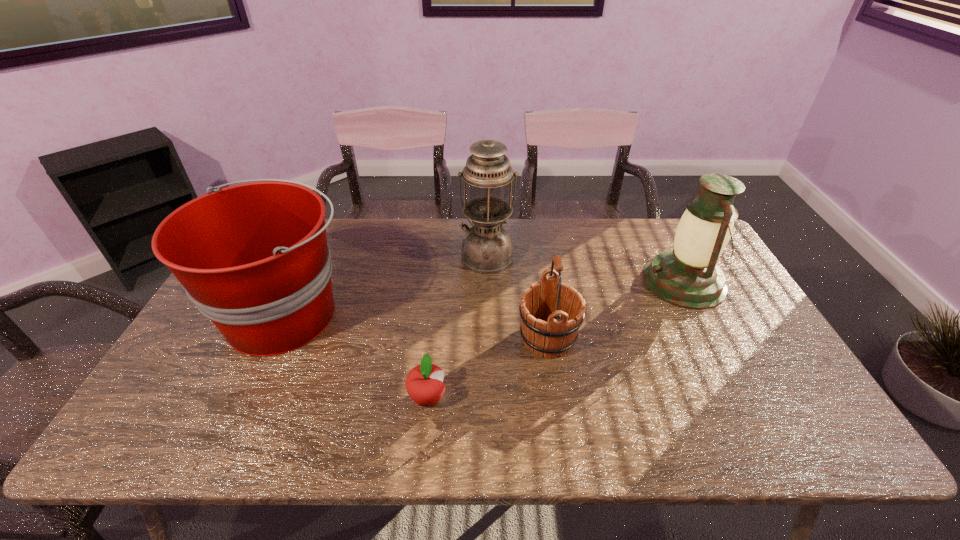
At what (x,y) coordinates should I click in order to perform the action: click on oil lamp. Please return your answer as a coordinate pair (x, y). Looking at the image, I should click on (487, 248).

This screenshot has width=960, height=540. In order to click on the rightmost object in this screenshot , I will do `click(687, 276)`.

Identify the location of bucket. The width and height of the screenshot is (960, 540). (254, 258).

At what (x,y) coordinates should I click in order to perform the action: click on wine bucket. Please return your answer as a coordinate pair (x, y). Looking at the image, I should click on (551, 312).

You are a GUI agent. You are given a task and a screenshot of the screen. Output one action in this format:
    pyautogui.click(x=<x>, y=<y>)
    Task: Click on the shortest object
    The image size is (960, 540).
    Given the screenshot: What is the action you would take?
    pyautogui.click(x=424, y=383)

Where is `the nearest object`? the nearest object is located at coordinates (424, 383).

Identify the location of vacant area situated on the back of the oil lamp. This screenshot has height=540, width=960. (487, 228).

Locate an element on the screen. vacant space located with the light compartment facing forward on the rightmost object is located at coordinates (572, 281).

You are a GUI agent. You are given a task and a screenshot of the screen. Output one action in this format:
    pyautogui.click(x=<x>, y=<y>)
    Task: Click on the free region located 0.120m with the light compartment facing forward on the rightmost object
    The image size is (960, 540).
    Given the screenshot: What is the action you would take?
    pyautogui.click(x=605, y=281)

Image resolution: width=960 pixels, height=540 pixels. I want to click on vacant space situated with the light compartment facing forward on the rightmost object, so click(552, 281).